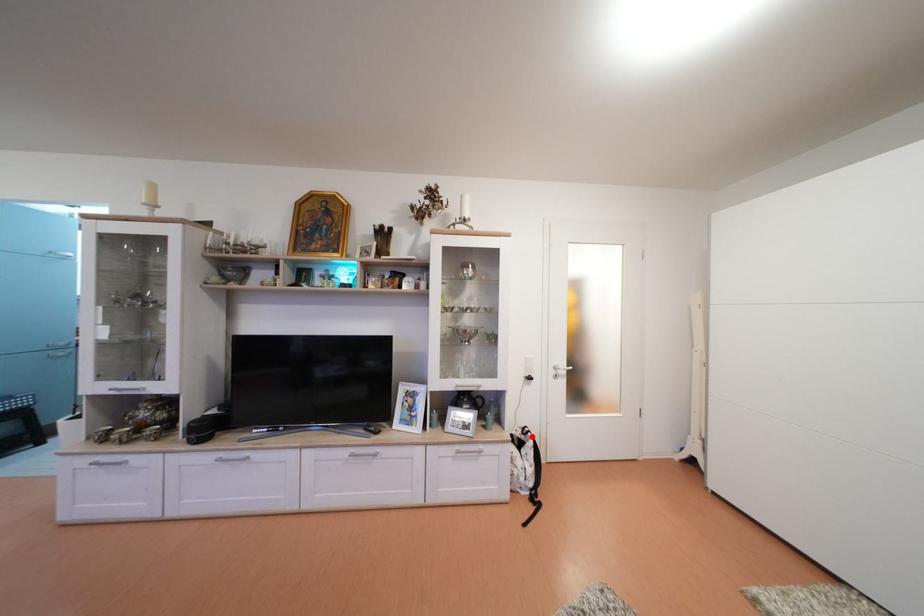
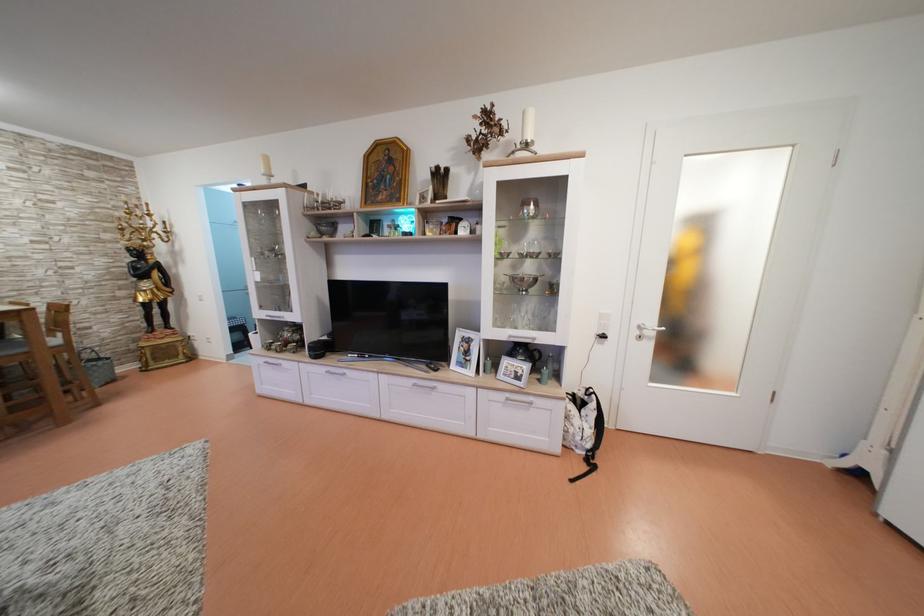
Question: I am providing you with two images of the same scene from different viewpoints. In image1, a red point is highlighted. Considering the same 3D point in image2, which of the following is correct?

Choices:
 (A) It is closer
 (B) It is farther

Answer: (A)